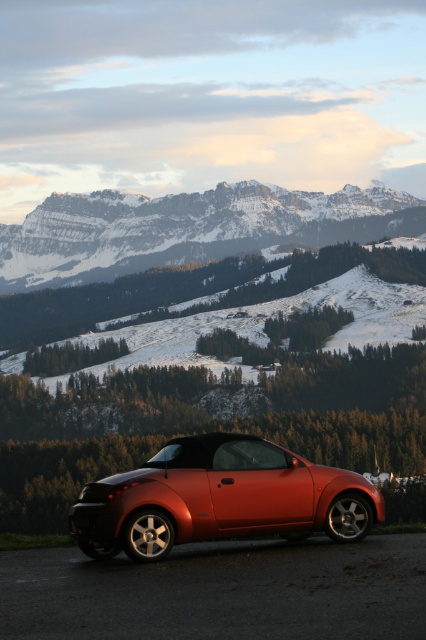
Question: Is snowy rocky mountain at upper center to the left of shiny metallic car at center from the viewer's perspective?

Choices:
 (A) yes
 (B) no

Answer: (A)

Question: Among these objects, which one is nearest to the camera?

Choices:
 (A) shiny metallic car at center
 (B) snowy rocky mountain at upper center

Answer: (A)

Question: Does snowy rocky mountain at upper center have a smaller size compared to shiny metallic car at center?

Choices:
 (A) no
 (B) yes

Answer: (A)

Question: In this image, where is snowy rocky mountain at upper center located relative to shiny metallic car at center?

Choices:
 (A) below
 (B) above

Answer: (B)

Question: Which point is closer to the camera taking this photo?

Choices:
 (A) (140, 497)
 (B) (244, 228)

Answer: (A)

Question: Which of the following is the closest to the observer?

Choices:
 (A) snowy rocky mountain at upper center
 (B) shiny metallic car at center

Answer: (B)